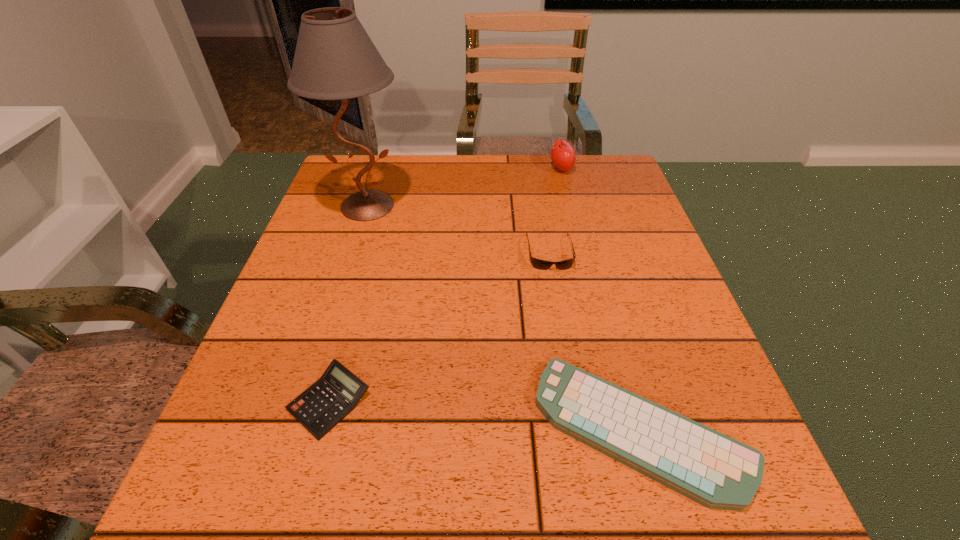
This screenshot has height=540, width=960. Identify the location of the tallest object. (335, 59).

You are a GUI agent. You are given a task and a screenshot of the screen. Output one action in this format:
    pyautogui.click(x=<x>, y=<y>)
    Task: Click on the table lamp
    Image resolution: width=960 pixels, height=540 pixels.
    Given the screenshot: What is the action you would take?
    pyautogui.click(x=335, y=59)

Find the location of `the farthest object`. the farthest object is located at coordinates (563, 156).

You are a GUI agent. You are given a task and a screenshot of the screen. Output one action in this format:
    pyautogui.click(x=<x>, y=<y>)
    Task: Click on the apple
    This screenshot has height=540, width=960.
    Given the screenshot: What is the action you would take?
    pyautogui.click(x=563, y=156)

The width and height of the screenshot is (960, 540). I want to click on the third farthest object, so click(537, 263).

I want to click on calculator, so click(x=323, y=405).

Locate an element on the screen. computer keyboard is located at coordinates (714, 470).

You are a GUI agent. You are given a task and a screenshot of the screen. Output one action in this format:
    pyautogui.click(x=<x>, y=<y>)
    Task: Click on the free location located 0.180m on the front-facing side of the fourth nearest object
    
    Given the screenshot: What is the action you would take?
    pyautogui.click(x=342, y=287)

Identify the location of vacant region located 0.390m on the left of the apple. This screenshot has width=960, height=540. (411, 168).

You are a GUI agent. You are given a task and a screenshot of the screen. Output one action in this format:
    pyautogui.click(x=<x>, y=<y>)
    Task: Click on the free spot located on the front-facing side of the third nearest object
    
    Given the screenshot: What is the action you would take?
    click(x=580, y=426)